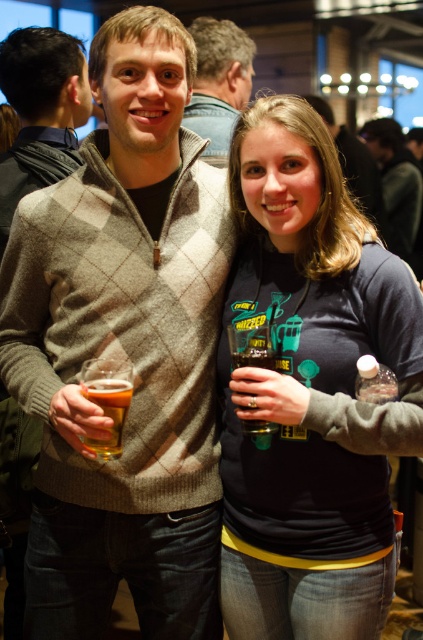
Question: Does knit sweater at center have a larger size compared to light brown sweater at center?

Choices:
 (A) no
 (B) yes

Answer: (A)

Question: Which point is closer to the camera?

Choices:
 (A) light brown sweater at center
 (B) green matte glass at center
 (C) dark gray sweatshirt at center

Answer: (C)

Question: Which point appears farthest from the camera in this image?

Choices:
 (A) (258, 419)
 (B) (378, 388)

Answer: (A)

Question: Is the position of knit sweater at center less distant than that of dark gray sweatshirt at center?

Choices:
 (A) yes
 (B) no

Answer: (A)

Question: Among these objects, which one is farthest from the camera?

Choices:
 (A) clear plastic bottle at lower right
 (B) light brown sweater at center
 (C) denim jacket at upper center

Answer: (B)

Question: Does knit sweater at center appear under light brown sweater at center?

Choices:
 (A) no
 (B) yes

Answer: (B)